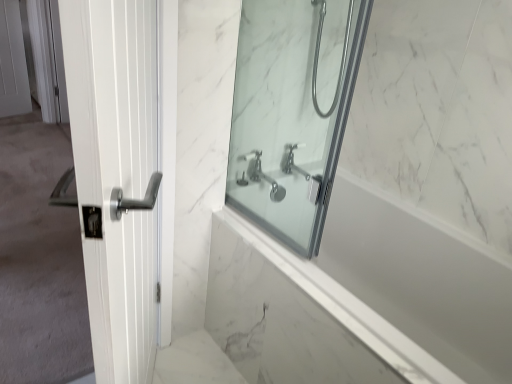
I want to click on clear glass shower door at center, so click(292, 112).

The width and height of the screenshot is (512, 384). What do you see at coordinates (122, 169) in the screenshot? I see `white glossy door handle at left` at bounding box center [122, 169].

Locate an element on the screen. chrome metallic faucet at center is located at coordinates (262, 175).

Describe the element at coordinates (381, 287) in the screenshot. I see `white marble bathtub at center` at that location.

Measure the distance between point (x=441, y=254) and camera.

The depth of point (x=441, y=254) is 5.17 feet.

The image size is (512, 384). What are the coordinates of `clear glass shower door at center` in the screenshot? It's located at point(292,112).

Is point (312, 92) farther from camera compared to point (244, 85)?

Yes.

Considering the relative sizes of satin nickel showerhead at upper center and clear glass shower door at center in the image provided, is satin nickel showerhead at upper center shorter than clear glass shower door at center?

Yes.

From a real-world perspective, is satin nickel showerhead at upper center located higher than clear glass shower door at center?

Yes, from a real-world perspective, satin nickel showerhead at upper center is above clear glass shower door at center.

Consider the image. Can you confirm if satin nickel showerhead at upper center is wider than clear glass shower door at center?

Yes.

Is white glossy door handle at left facing towards clear glass shower door at center?

No, white glossy door handle at left is not facing towards clear glass shower door at center.

Which of these two, white glossy door handle at left or clear glass shower door at center, stands shorter?

clear glass shower door at center is shorter.

Would you consider white glossy door handle at left to be distant from clear glass shower door at center?

white glossy door handle at left is near clear glass shower door at center, not far away.

Considering the relative sizes of white glossy door handle at left and clear glass shower door at center in the image provided, is white glossy door handle at left thinner than clear glass shower door at center?

In fact, white glossy door handle at left might be wider than clear glass shower door at center.

Would you say clear glass shower door at center is to the left or to the right of satin nickel showerhead at upper center in the picture?

In the image, clear glass shower door at center appears on the left side of satin nickel showerhead at upper center.

From a real-world perspective, is clear glass shower door at center located beneath satin nickel showerhead at upper center?

Yes, from a real-world perspective, clear glass shower door at center is under satin nickel showerhead at upper center.

Is white marble bathtub at center outside of satin nickel showerhead at upper center?

Yes.

Does white marble bathtub at center have a lesser height compared to satin nickel showerhead at upper center?

No.

How many degrees apart are the facing directions of white marble bathtub at center and satin nickel showerhead at upper center?

90 degrees.

From the image's perspective, between white marble bathtub at center and satin nickel showerhead at upper center, who is located below?

white marble bathtub at center appears lower in the image.

From a real-world perspective, is white glossy door handle at left positioned under white marble bathtub at center based on gravity?

No, from a real-world perspective, white glossy door handle at left is not under white marble bathtub at center.

Is white glossy door handle at left facing away from white marble bathtub at center?

No, white glossy door handle at left's orientation is not away from white marble bathtub at center.

Is point (29, 12) closer or farther from the camera than point (230, 289)?

Clearly, point (29, 12) is more distant from the camera than point (230, 289).

From the image's perspective, is white glossy door handle at left located beneath white marble bathtub at center?

Actually, white glossy door handle at left appears above white marble bathtub at center in the image.

You are a GUI agent. You are given a task and a screenshot of the screen. Output one action in this format:
    pyautogui.click(x=<x>, y=<y>)
    Task: Click on the bath below the white glossy door handle at left (from a real-world perspective)
    The image size is (512, 384).
    Given the screenshot: What is the action you would take?
    pyautogui.click(x=381, y=287)

Can you see white glossy door handle at left touching white marble bathtub at center?

No, white glossy door handle at left is not making contact with white marble bathtub at center.

How distant is white glossy door handle at left from white marble bathtub at center?

1.02 meters.

Which object is further away from the camera taking this photo, white glossy door handle at left or white marble bathtub at center?

white marble bathtub at center is further from the camera.

Is satin nickel showerhead at upper center looking in the opposite direction of white marble bathtub at center?

No, satin nickel showerhead at upper center is not facing away from white marble bathtub at center.

Between satin nickel showerhead at upper center and white marble bathtub at center, which one has more height?

Standing taller between the two is white marble bathtub at center.

Would you say satin nickel showerhead at upper center is outside white marble bathtub at center?

Yes, satin nickel showerhead at upper center is not within white marble bathtub at center.

Where is `bath lying below the satin nickel showerhead at upper center (from the image's perspective)`? The height and width of the screenshot is (384, 512). bath lying below the satin nickel showerhead at upper center (from the image's perspective) is located at coordinates (381, 287).

Image resolution: width=512 pixels, height=384 pixels. Find the location of `shower above the clear glass shower door at center (from the image's perspective)`. shower above the clear glass shower door at center (from the image's perspective) is located at coordinates (318, 57).

Image resolution: width=512 pixels, height=384 pixels. Find the location of `mirror on the right of the white glossy door handle at left`. mirror on the right of the white glossy door handle at left is located at coordinates (292, 112).

Based on their spatial positions, is white marble bathtub at center or clear glass shower door at center further from white glossy door handle at left?

Among the two, white marble bathtub at center is located further to white glossy door handle at left.

Looking at the image, which one is located further to satin nickel showerhead at upper center, white glossy door handle at left or chrome metallic faucet at center?

The object further to satin nickel showerhead at upper center is white glossy door handle at left.

When comparing their distances from white marble bathtub at center, does white glossy door handle at left or clear glass shower door at center seem further?

white glossy door handle at left is positioned further to the anchor white marble bathtub at center.

Which object lies further to the anchor point chrome metallic faucet at center, white marble bathtub at center or white glossy door handle at left?

white glossy door handle at left.

Considering their positions, is white marble bathtub at center positioned closer to white glossy door handle at left than clear glass shower door at center?

clear glass shower door at center is closer to white glossy door handle at left.

Estimate the real-world distances between objects in this image. Which object is further from satin nickel showerhead at upper center, clear glass shower door at center or white glossy door handle at left?

The object further to satin nickel showerhead at upper center is white glossy door handle at left.

Based on their spatial positions, is satin nickel showerhead at upper center or white marble bathtub at center closer to chrome metallic faucet at center?

satin nickel showerhead at upper center.

Based on their spatial positions, is white marble bathtub at center or satin nickel showerhead at upper center closer to clear glass shower door at center?

Based on the image, satin nickel showerhead at upper center appears to be nearer to clear glass shower door at center.

The height and width of the screenshot is (384, 512). I want to click on mirror between white glossy door handle at left and white marble bathtub at center, so click(x=292, y=112).

I want to click on mirror positioned between white glossy door handle at left and chrome metallic faucet at center from near to far, so click(x=292, y=112).

You are a GUI agent. You are given a task and a screenshot of the screen. Output one action in this format:
    pyautogui.click(x=<x>, y=<y>)
    Task: Click on the screen door between white glossy door handle at left and satin nickel showerhead at upper center along the z-axis
    The width and height of the screenshot is (512, 384).
    Given the screenshot: What is the action you would take?
    pyautogui.click(x=37, y=214)

Find the location of a particular element. Image resolution: width=512 pixels, height=384 pixels. tap between white glossy door handle at left and white marble bathtub at center is located at coordinates (262, 175).